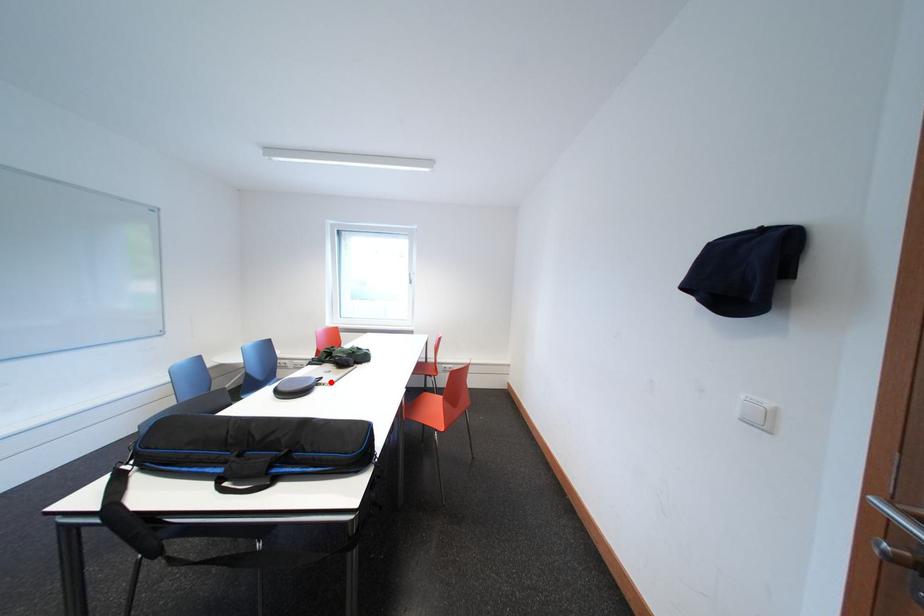
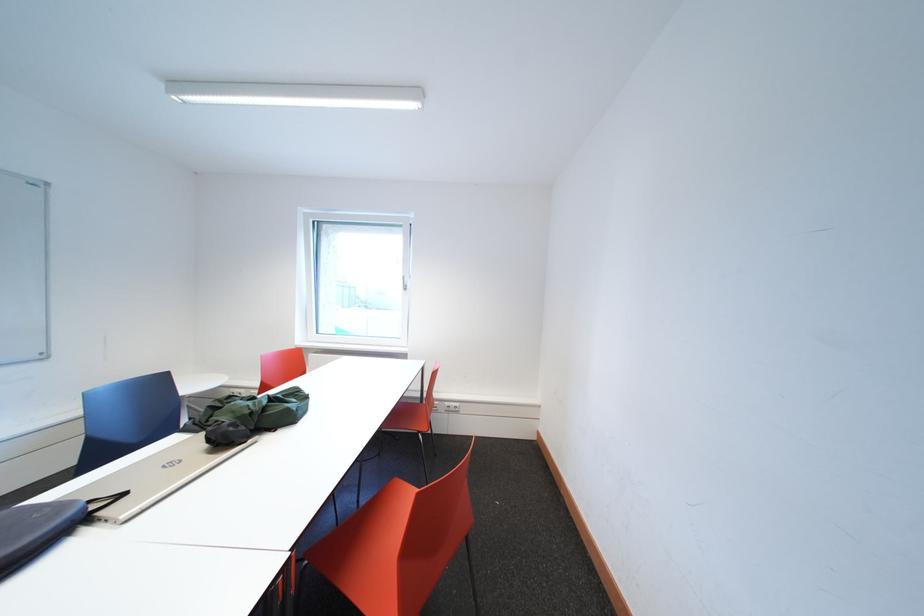
In the second image, find the point that corresponds to the highlighted location in the first image.

(134, 499)